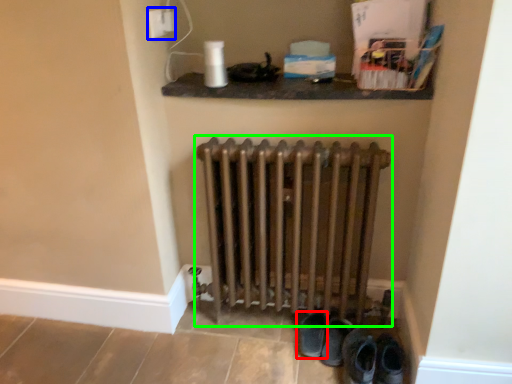
Question: Which object is the farthest from footwear (highlighted by a red box)? Choose among these: electric outlet (highlighted by a blue box) or radiator (highlighted by a green box).

Choices:
 (A) electric outlet
 (B) radiator

Answer: (A)